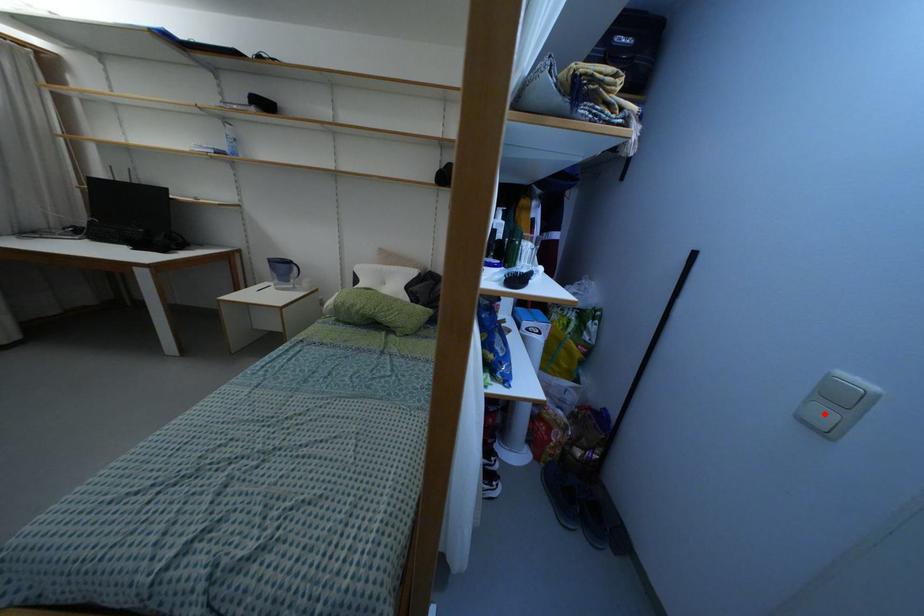
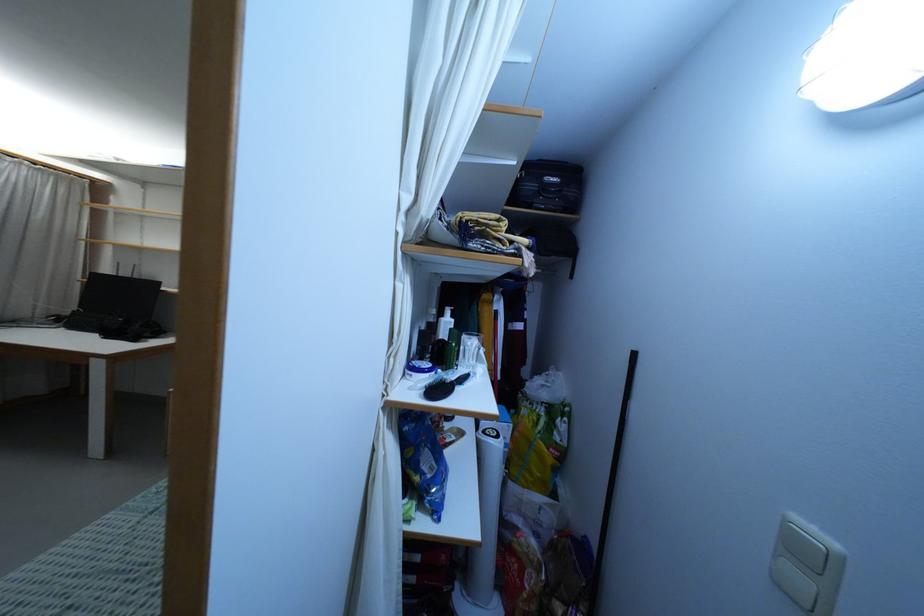
Find the pixel in the second image that matches the highlighted location in the first image.

(799, 580)